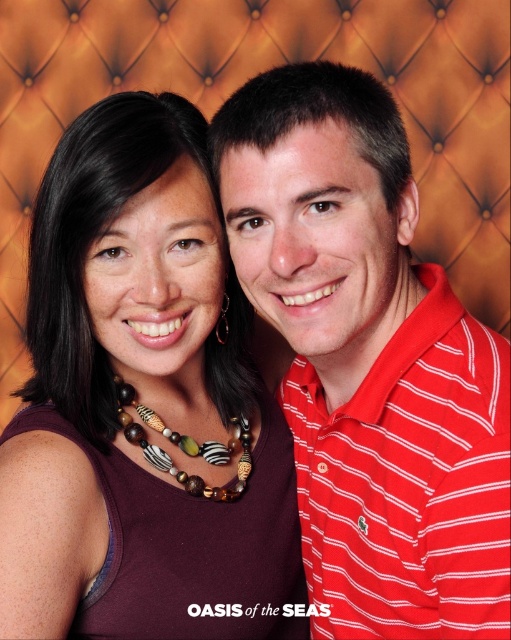
Question: Can you confirm if matte brown necklace at center is smaller than red striped polo shirt at right?

Choices:
 (A) no
 (B) yes

Answer: (A)

Question: Is matte brown necklace at center above red striped polo shirt at right?

Choices:
 (A) no
 (B) yes

Answer: (A)

Question: Is matte brown necklace at center closer to camera compared to red striped polo shirt at right?

Choices:
 (A) no
 (B) yes

Answer: (A)

Question: Which object is closer to the camera taking this photo?

Choices:
 (A) red striped polo shirt at right
 (B) wooden and zebra-patterned beads at center
 (C) matte brown necklace at center

Answer: (A)

Question: Which point appears closest to the camera in this image?

Choices:
 (A) (208, 496)
 (B) (122, 449)

Answer: (B)

Question: Which point is closer to the camera taking this photo?

Choices:
 (A) (283, 84)
 (B) (69, 515)

Answer: (A)